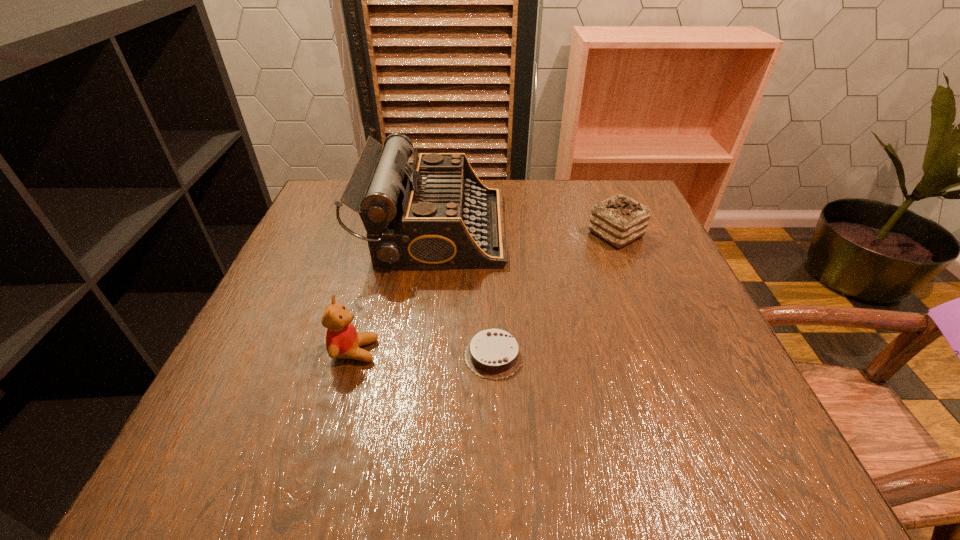
Where is `vacant space at the far right corner`? The image size is (960, 540). vacant space at the far right corner is located at coordinates (638, 194).

Identify the location of vacant space at the near right corner of the desktop. (660, 427).

This screenshot has width=960, height=540. I want to click on free space between the tallest object and the taller chocolate cake, so click(x=525, y=231).

Where is `empty location between the shortest object and the tallest object`? empty location between the shortest object and the tallest object is located at coordinates (465, 292).

Find the location of a particular element. This screenshot has height=540, width=960. free spot between the second shortest object and the shorter chocolate cake is located at coordinates (555, 294).

Where is `free space between the typewriter and the nearer chocolate cake`? free space between the typewriter and the nearer chocolate cake is located at coordinates (465, 292).

What are the coordinates of `empty space between the farther chocolate cake and the shortest object` in the screenshot? It's located at (555, 294).

You are a GUI agent. You are given a task and a screenshot of the screen. Output one action in this format:
    pyautogui.click(x=<x>, y=<y>)
    Task: Click on the vacant point located between the rightmost object and the tallest object
    
    Given the screenshot: What is the action you would take?
    pyautogui.click(x=525, y=231)

You are a GUI agent. You are given a task and a screenshot of the screen. Output one action in this format:
    pyautogui.click(x=<x>, y=<y>)
    Task: Click on the free space between the shorter chocolate cake and the third shortest object
    The image size is (960, 540).
    Given the screenshot: What is the action you would take?
    pyautogui.click(x=424, y=353)

Find the location of a particular element. The height and width of the screenshot is (540, 960). free point between the tallest object and the right chocolate cake is located at coordinates (525, 231).